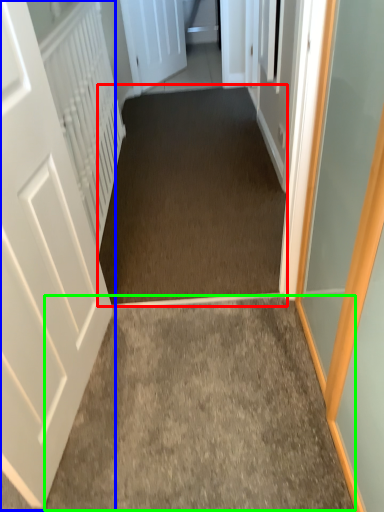
Question: Estimate the real-world distances between objects in this image. Which object is closer to corridor (highlighted by a red box), door (highlighted by a blue box) or path (highlighted by a green box)?

Choices:
 (A) door
 (B) path

Answer: (B)